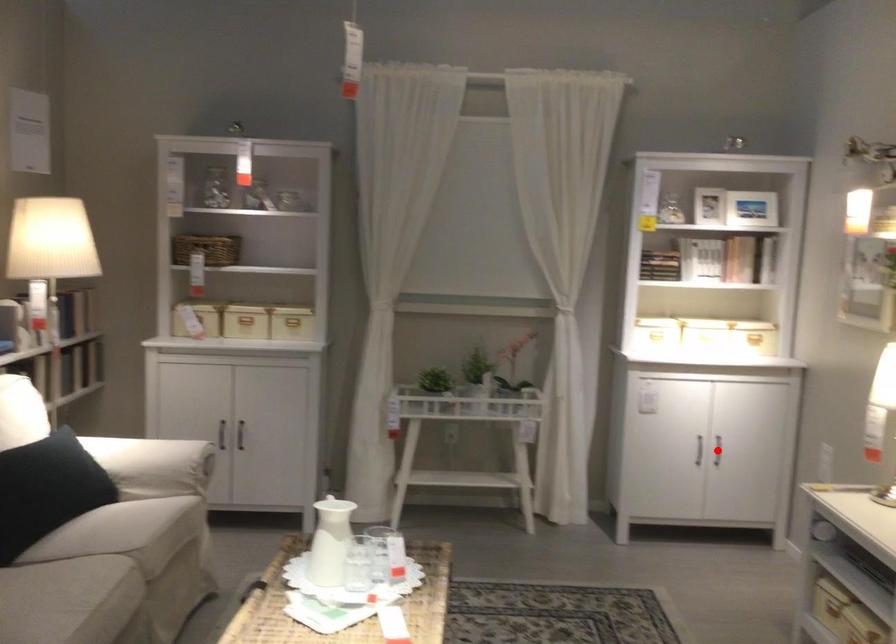
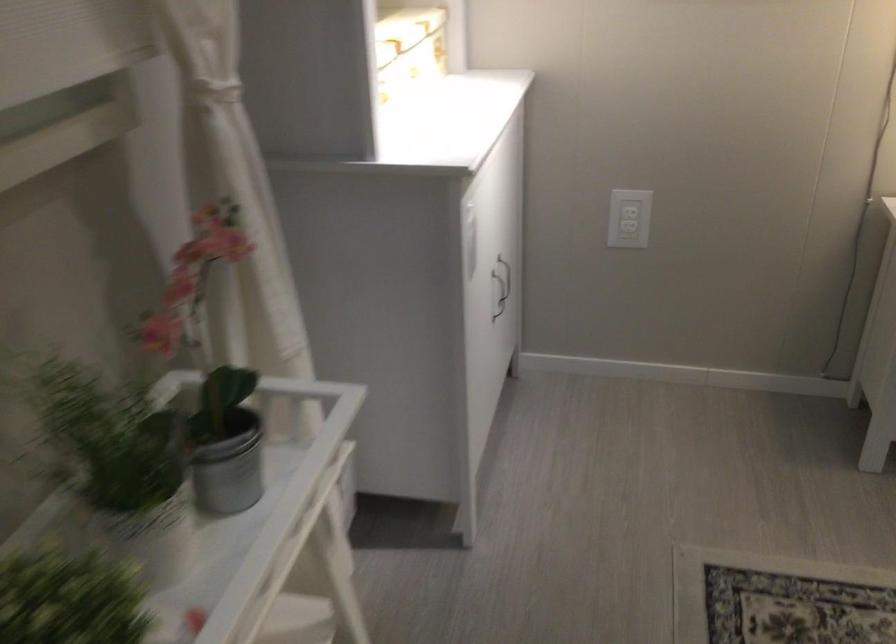
Question: I am providing you with two images of the same scene from different viewpoints. A red point is marked on the first image. Is the red point's position out of view in image 2?

Choices:
 (A) Yes
 (B) No

Answer: (A)